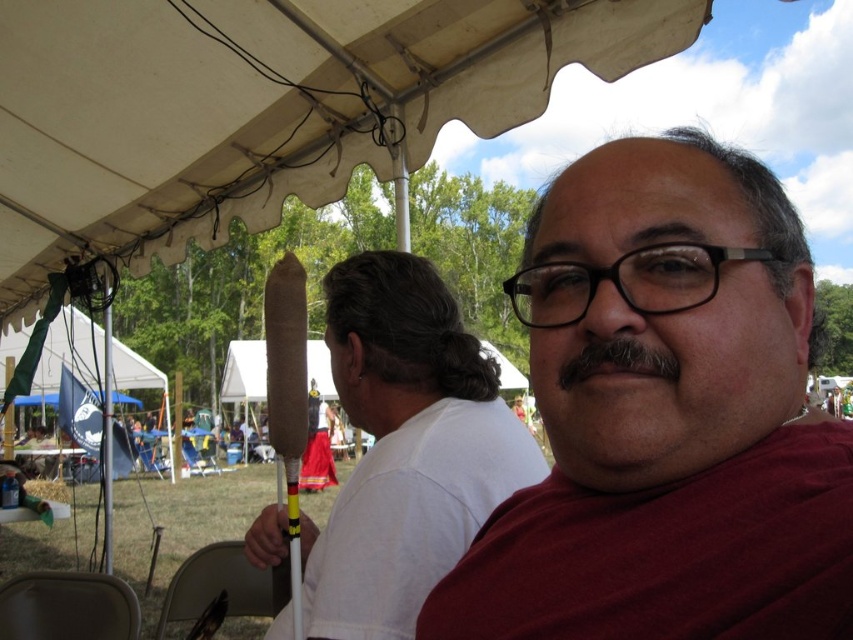
Question: Based on their relative distances, which object is nearer to the brown paper cone at center?

Choices:
 (A) maroon fabric shirt at center
 (B) white fabric canopy at upper center
 (C) gray fuzzy mustache at center

Answer: (A)

Question: Which point is farther from the camera taking this photo?

Choices:
 (A) (309, 625)
 (B) (654, 186)
 (C) (641, 28)
 (D) (575, 368)

Answer: (C)

Question: Considering the relative positions of maroon fabric shirt at center and gray fuzzy mustache at center in the image provided, where is maroon fabric shirt at center located with respect to gray fuzzy mustache at center?

Choices:
 (A) below
 (B) above

Answer: (A)

Question: Does maroon fabric shirt at center have a greater width compared to white fabric canopy at upper center?

Choices:
 (A) yes
 (B) no

Answer: (B)

Question: Is maroon fabric shirt at center positioned at the back of white fabric canopy at upper center?

Choices:
 (A) yes
 (B) no

Answer: (B)

Question: Which point is closer to the camera?

Choices:
 (A) click(204, 36)
 (B) click(419, 378)

Answer: (B)